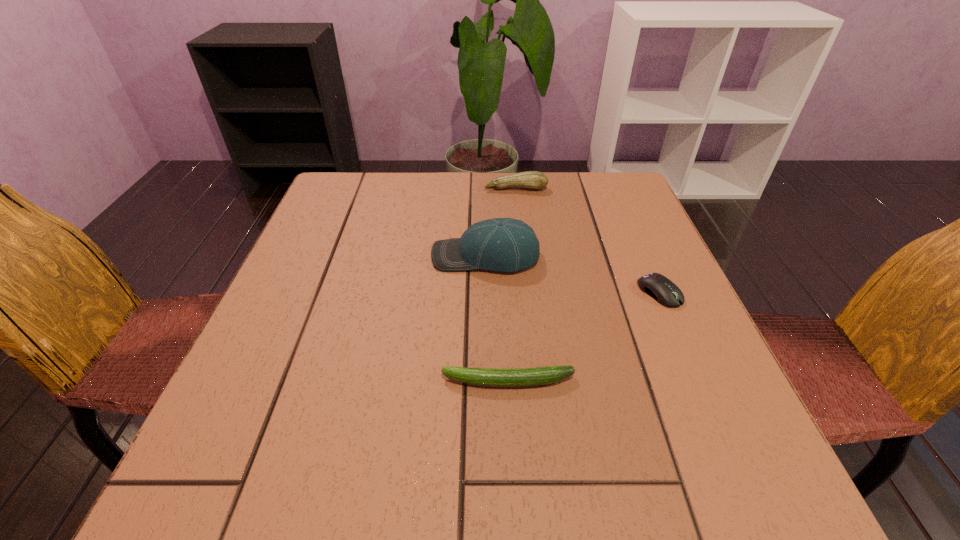
Where is `the tallest object`? the tallest object is located at coordinates (509, 245).

What are the coordinates of `baseball cap` in the screenshot? It's located at (509, 245).

Find the location of a particular element. The width and height of the screenshot is (960, 540). the taller zucchini is located at coordinates (536, 180).

The width and height of the screenshot is (960, 540). Find the location of `the farthest object`. the farthest object is located at coordinates (536, 180).

Image resolution: width=960 pixels, height=540 pixels. Identify the location of computer equipment. [x=664, y=291].

Find the location of a particular element. The height and width of the screenshot is (540, 960). the rightmost object is located at coordinates (664, 291).

Image resolution: width=960 pixels, height=540 pixels. Identify the location of the nearer zucchini. (523, 377).

Identify the location of the shorter zucchini. The width and height of the screenshot is (960, 540). (523, 377).

Locate an element on the screen. The image size is (960, 540). free space located on the front of the third nearest object is located at coordinates (487, 330).

Where is `free space located at the stem end of the third shortest object`? free space located at the stem end of the third shortest object is located at coordinates (521, 238).